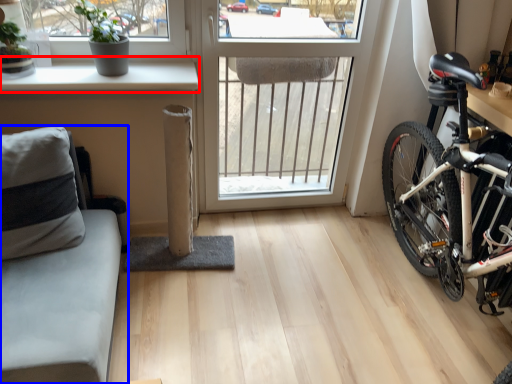
Question: Which object is further to the camera taking this photo, window sill (highlighted by a red box) or studio couch (highlighted by a blue box)?

Choices:
 (A) window sill
 (B) studio couch

Answer: (A)